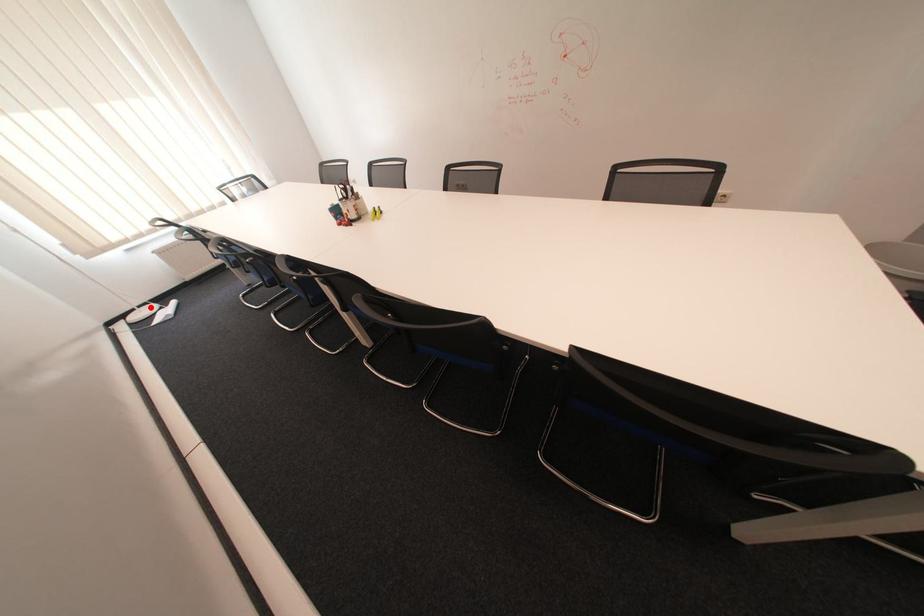
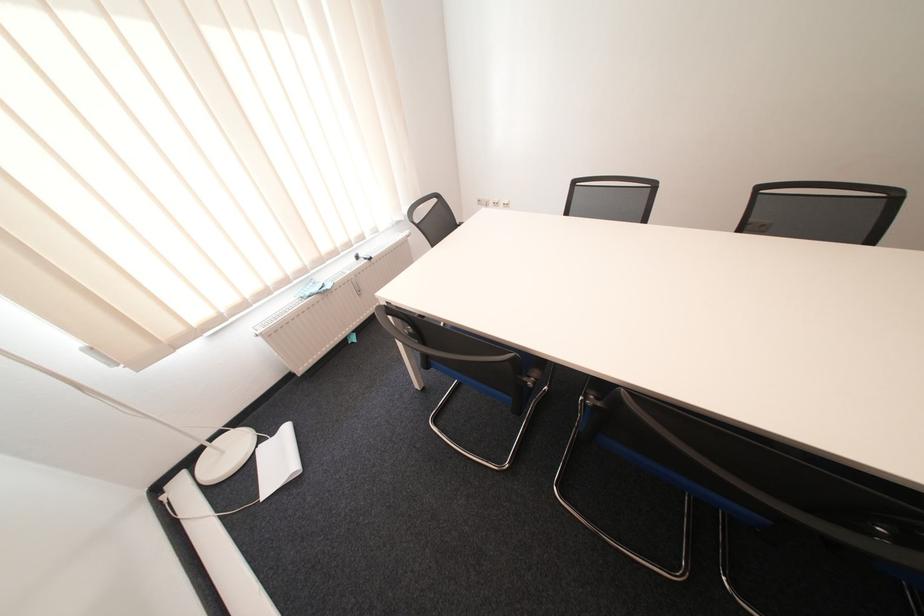
Question: A red point is marked in image1. In image2, is the corresponding 3D point closer to the camera or farther? Reply with the corresponding letter.

Choices:
 (A) The corresponding 3D point is closer.
 (B) The corresponding 3D point is farther.

Answer: (A)